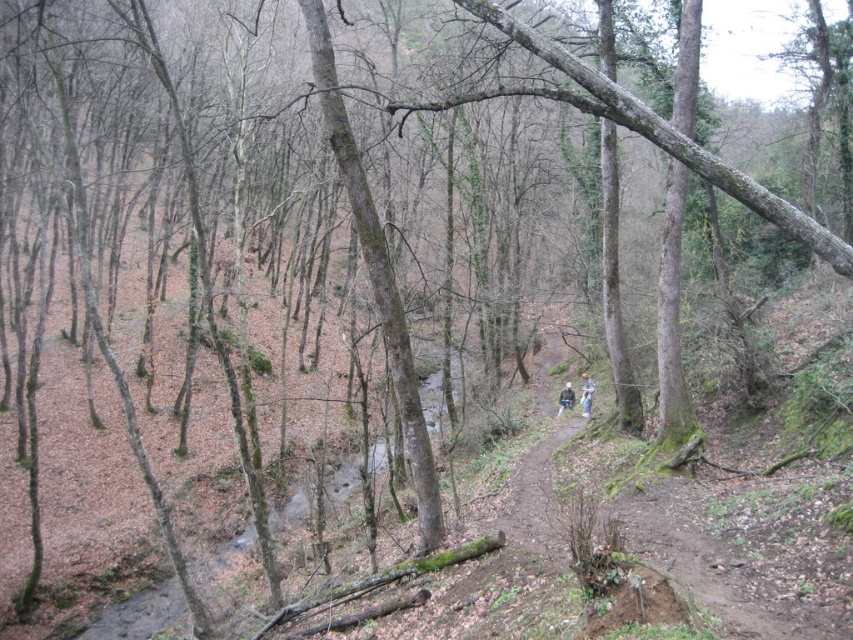
Who is lower down, blue denim jeans at center or blue fabric pants at center?

Positioned lower is blue fabric pants at center.

Is blue denim jeans at center smaller than blue fabric pants at center?

No, blue denim jeans at center is not smaller than blue fabric pants at center.

Image resolution: width=853 pixels, height=640 pixels. What are the coordinates of `blue denim jeans at center` in the screenshot? It's located at (587, 396).